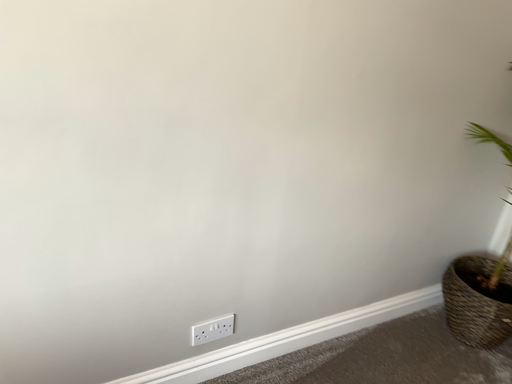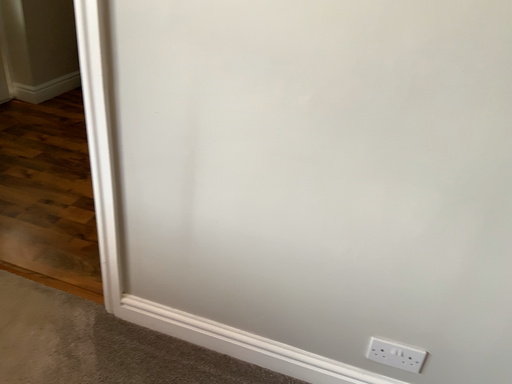
Question: Which way did the camera rotate in the video?

Choices:
 (A) rotated left
 (B) rotated right

Answer: (A)